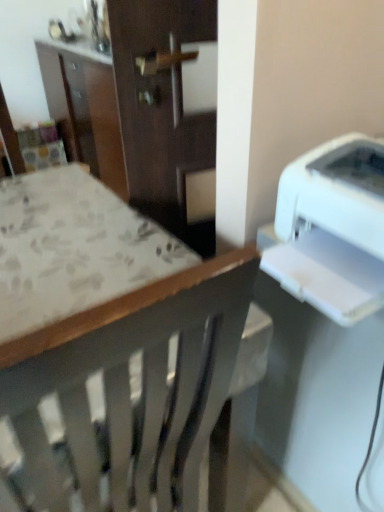
Question: Considering the positions of white plastic printer at right and wooden chair at center in the image, is white plastic printer at right taller or shorter than wooden chair at center?

Choices:
 (A) tall
 (B) short

Answer: (B)

Question: In the image, is white plastic printer at right positioned in front of or behind wooden chair at center?

Choices:
 (A) front
 (B) behind

Answer: (B)

Question: From a real-world perspective, is white plastic printer at right physically located above or below wooden chair at center?

Choices:
 (A) above
 (B) below

Answer: (A)

Question: Would you say wooden chair at center is to the left or to the right of white plastic printer at right in the picture?

Choices:
 (A) left
 (B) right

Answer: (A)

Question: From a real-world perspective, is wooden chair at center physically located above or below white plastic printer at right?

Choices:
 (A) below
 (B) above

Answer: (A)

Question: In terms of size, does wooden chair at center appear bigger or smaller than white plastic printer at right?

Choices:
 (A) small
 (B) big

Answer: (B)

Question: In terms of width, does wooden chair at center look wider or thinner when compared to white plastic printer at right?

Choices:
 (A) thin
 (B) wide

Answer: (B)